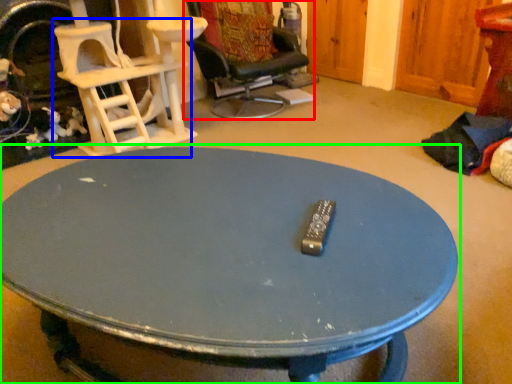
Question: Which is nearer to the chair (highlighted by a red box)? chair (highlighted by a blue box) or coffee table (highlighted by a green box).

Choices:
 (A) chair
 (B) coffee table

Answer: (A)